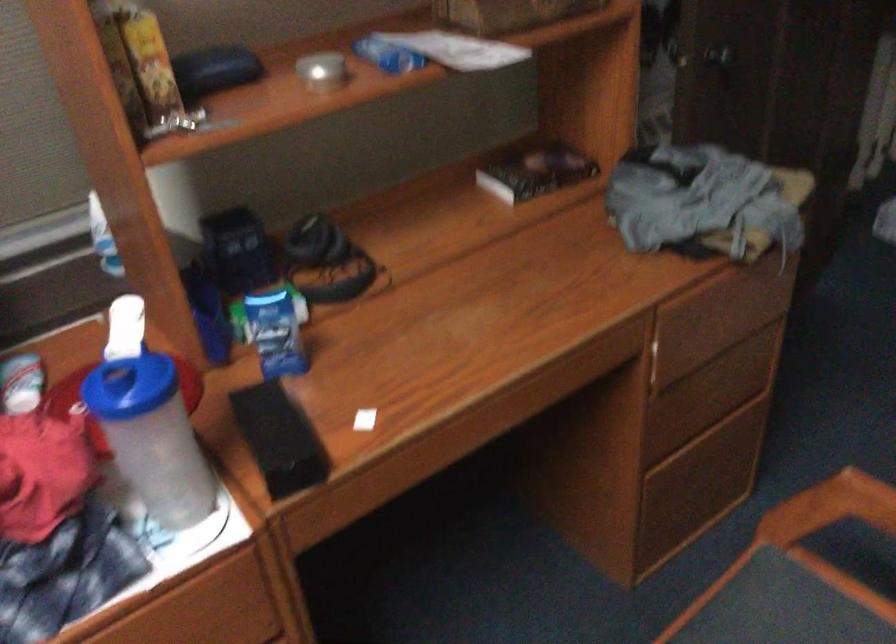
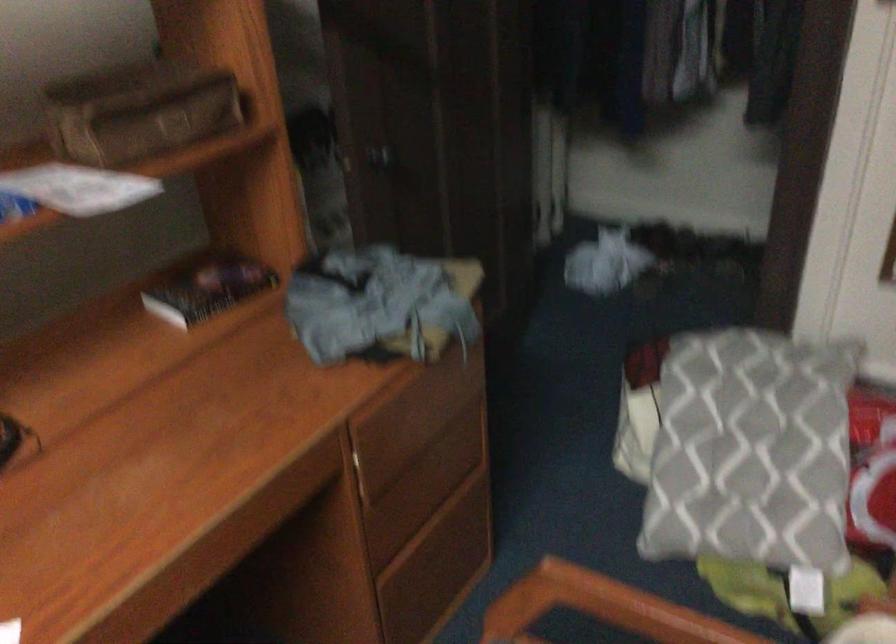
Which direction would the cameraman need to move to produce the second image?

The movement direction of the cameraman is right, forward.